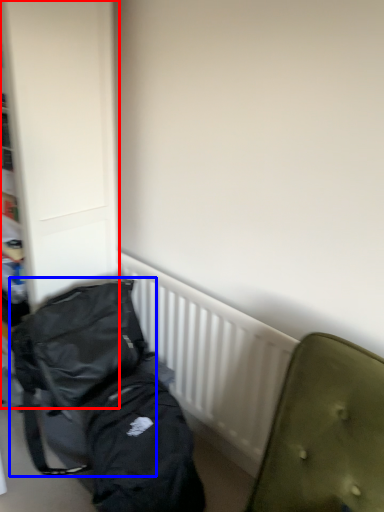
Question: Which point is closer to the camera, dresser (highlighted by a red box) or backpack (highlighted by a blue box)?

Choices:
 (A) dresser
 (B) backpack

Answer: (A)